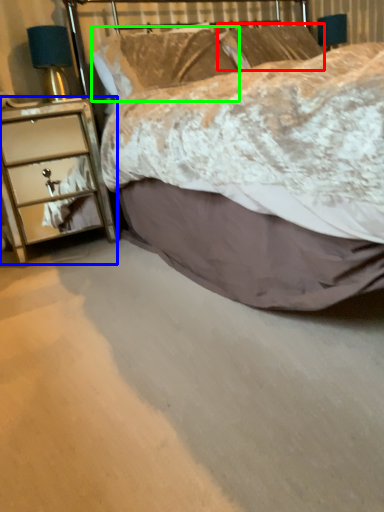
Question: Based on their relative distances, which object is nearer to pillow (highlighted by a red box)? Choose from chest of drawers (highlighted by a blue box) and pillow (highlighted by a green box).

Choices:
 (A) chest of drawers
 (B) pillow

Answer: (B)